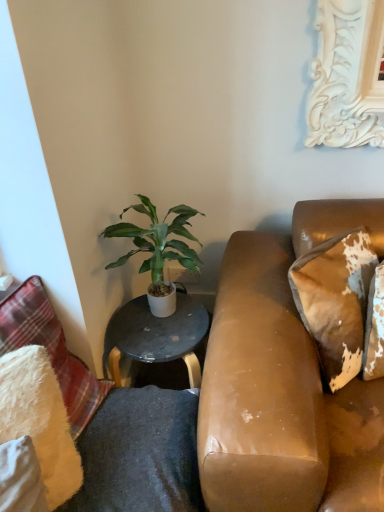
The width and height of the screenshot is (384, 512). What do you see at coordinates (51, 349) in the screenshot? I see `fluffy white pillow at left, the 1th pillow in the left-to-right sequence` at bounding box center [51, 349].

What do you see at coordinates (39, 419) in the screenshot? This screenshot has height=512, width=384. I see `white fluffy pillow at lower left, placed as the 2th pillow when sorted from left to right` at bounding box center [39, 419].

Describe the element at coordinates (154, 338) in the screenshot. I see `white glossy table at center` at that location.

What is the approximate width of leather-like brown pillow at right, the 1th pillow viewed from the right?

10.71 inches.

You are a GUI agent. You are given a task and a screenshot of the screen. Output one action in this format:
    pyautogui.click(x=<x>, y=<y>)
    Task: Click on the green leafy plant at center
    
    Given the screenshot: What is the action you would take?
    pyautogui.click(x=157, y=242)

Identify the location of fluffy white pillow at left, which is the third pillow from right to left. Image resolution: width=384 pixels, height=512 pixels. (51, 349).

Does point (315, 272) lie in front of point (140, 305)?

Yes, it is in front of point (140, 305).

Are leather-like brown pillow at right, placed as the third pillow when sorted from left to right, and white glossy table at center located far from each other?

No, leather-like brown pillow at right, placed as the third pillow when sorted from left to right, is in close proximity to white glossy table at center.

From the image's perspective, is leather-like brown pillow at right, the 1th pillow viewed from the right, on white glossy table at center?

Yes, from the image's perspective, leather-like brown pillow at right, the 1th pillow viewed from the right, is on top of white glossy table at center.

Who is shorter, fluffy white pillow at left, the 1th pillow in the left-to-right sequence, or green leafy plant at center?

fluffy white pillow at left, the 1th pillow in the left-to-right sequence, is shorter.

Which of these two, fluffy white pillow at left, which is the third pillow from right to left, or green leafy plant at center, is smaller?

With smaller size is green leafy plant at center.

Looking at this image, from the image's perspective, is fluffy white pillow at left, which is the third pillow from right to left, below green leafy plant at center?

Yes, from the image's perspective, fluffy white pillow at left, which is the third pillow from right to left, is beneath green leafy plant at center.

Based on the photo, is fluffy white pillow at left, the 1th pillow in the left-to-right sequence, oriented away from green leafy plant at center?

No, fluffy white pillow at left, the 1th pillow in the left-to-right sequence, is not facing the opposite direction of green leafy plant at center.

In terms of width, does white fluffy pillow at lower left, placed as the 2th pillow when sorted from left to right, look wider or thinner when compared to green leafy plant at center?

Considering their sizes, white fluffy pillow at lower left, placed as the 2th pillow when sorted from left to right, looks slimmer than green leafy plant at center.

Based on the photo, from a real-world perspective, is white fluffy pillow at lower left, placed as the 2th pillow when sorted from left to right, above or below green leafy plant at center?

white fluffy pillow at lower left, placed as the 2th pillow when sorted from left to right, is below green leafy plant at center.

Looking at this image, is white fluffy pillow at lower left, placed as the 2th pillow when sorted from right to left, not within green leafy plant at center?

That's correct, white fluffy pillow at lower left, placed as the 2th pillow when sorted from right to left, is outside of green leafy plant at center.

From their relative heights in the image, would you say white fluffy pillow at lower left, placed as the 2th pillow when sorted from right to left, is taller or shorter than green leafy plant at center?

Considering their sizes, white fluffy pillow at lower left, placed as the 2th pillow when sorted from right to left, has less height than green leafy plant at center.

Is white fluffy pillow at lower left, placed as the 2th pillow when sorted from right to left, placed right next to white glossy table at center?

No, white fluffy pillow at lower left, placed as the 2th pillow when sorted from right to left, is not touching white glossy table at center.

What are the coordinates of `the 3rd pillow in front of the white glossy table at center, counting from the anchor's position` in the screenshot? It's located at (39, 419).

Relative to white glossy table at center, is white fluffy pillow at lower left, placed as the 2th pillow when sorted from left to right, in front or behind?

In the image, white fluffy pillow at lower left, placed as the 2th pillow when sorted from left to right, appears in front of white glossy table at center.

Considering the relative sizes of white fluffy pillow at lower left, placed as the 2th pillow when sorted from right to left, and white glossy table at center in the image provided, is white fluffy pillow at lower left, placed as the 2th pillow when sorted from right to left, thinner than white glossy table at center?

Yes, white fluffy pillow at lower left, placed as the 2th pillow when sorted from right to left, is thinner than white glossy table at center.

Do you think fluffy white pillow at left, the 1th pillow in the left-to-right sequence, is within leather-like brown pillow at right, placed as the third pillow when sorted from left to right, or outside of it?

fluffy white pillow at left, the 1th pillow in the left-to-right sequence, is outside leather-like brown pillow at right, placed as the third pillow when sorted from left to right.

Based on the photo, does fluffy white pillow at left, the 1th pillow in the left-to-right sequence, have a greater width compared to leather-like brown pillow at right, placed as the third pillow when sorted from left to right?

Yes, fluffy white pillow at left, the 1th pillow in the left-to-right sequence, is wider than leather-like brown pillow at right, placed as the third pillow when sorted from left to right.

Which is nearer, (x=26, y=283) or (x=329, y=381)?

Point (x=26, y=283)

Is leather-like brown pillow at right, the 1th pillow viewed from the right, at the back of fluffy white pillow at left, the 1th pillow in the left-to-right sequence?

No, leather-like brown pillow at right, the 1th pillow viewed from the right, is not at the back of fluffy white pillow at left, the 1th pillow in the left-to-right sequence.

Is leather-like brown pillow at right, placed as the third pillow when sorted from left to right, to the left of white fluffy pillow at lower left, placed as the 2th pillow when sorted from left to right, from the viewer's perspective?

In fact, leather-like brown pillow at right, placed as the third pillow when sorted from left to right, is to the right of white fluffy pillow at lower left, placed as the 2th pillow when sorted from left to right.

From a real-world perspective, which is physically below, leather-like brown pillow at right, the 1th pillow viewed from the right, or white fluffy pillow at lower left, placed as the 2th pillow when sorted from left to right?

From a 3D spatial view, white fluffy pillow at lower left, placed as the 2th pillow when sorted from left to right, is below.

How different are the orientations of fluffy white pillow at left, which is the third pillow from right to left, and white glossy table at center in degrees?

There is a 66-degree angle between the facing directions of fluffy white pillow at left, which is the third pillow from right to left, and white glossy table at center.

Consider the image. Could white glossy table at center be considered to be inside fluffy white pillow at left, which is the third pillow from right to left?

No, white glossy table at center is not a part of fluffy white pillow at left, which is the third pillow from right to left.

Which is closer, (5, 324) or (105, 372)?

Point (5, 324) is closer to the camera than point (105, 372).

Is fluffy white pillow at left, which is the third pillow from right to left, closer to camera compared to white glossy table at center?

Yes, fluffy white pillow at left, which is the third pillow from right to left, is in front of white glossy table at center.

Where is `table below the leather-like brown pillow at right, the 1th pillow viewed from the right (from a real-world perspective)`? table below the leather-like brown pillow at right, the 1th pillow viewed from the right (from a real-world perspective) is located at coordinates (154, 338).

Locate an element on the screen. houseplant above the fluffy white pillow at left, the 1th pillow in the left-to-right sequence (from the image's perspective) is located at coordinates (157, 242).

From the image, which object appears to be nearer to white fluffy pillow at lower left, placed as the 2th pillow when sorted from right to left, leather-like brown pillow at right, placed as the third pillow when sorted from left to right, or white glossy table at center?

white glossy table at center lies closer to white fluffy pillow at lower left, placed as the 2th pillow when sorted from right to left, than the other object.

Based on their spatial positions, is green leafy plant at center or white fluffy pillow at lower left, placed as the 2th pillow when sorted from right to left, further from leather-like brown pillow at right, placed as the third pillow when sorted from left to right?

Among the two, white fluffy pillow at lower left, placed as the 2th pillow when sorted from right to left, is located further to leather-like brown pillow at right, placed as the third pillow when sorted from left to right.

Considering their positions, is leather-like brown pillow at right, the 1th pillow viewed from the right, positioned further to green leafy plant at center than fluffy white pillow at left, which is the third pillow from right to left?

leather-like brown pillow at right, the 1th pillow viewed from the right.

Which object lies nearer to the anchor point white glossy table at center, leather-like brown pillow at right, placed as the third pillow when sorted from left to right, or white fluffy pillow at lower left, placed as the 2th pillow when sorted from right to left?

Based on the image, white fluffy pillow at lower left, placed as the 2th pillow when sorted from right to left, appears to be nearer to white glossy table at center.

Looking at the image, which one is located closer to white fluffy pillow at lower left, placed as the 2th pillow when sorted from right to left, white glossy table at center or fluffy white pillow at left, which is the third pillow from right to left?

fluffy white pillow at left, which is the third pillow from right to left, is positioned closer to the anchor white fluffy pillow at lower left, placed as the 2th pillow when sorted from right to left.

From the image, which object appears to be nearer to fluffy white pillow at left, the 1th pillow in the left-to-right sequence, white fluffy pillow at lower left, placed as the 2th pillow when sorted from right to left, or green leafy plant at center?

Based on the image, white fluffy pillow at lower left, placed as the 2th pillow when sorted from right to left, appears to be nearer to fluffy white pillow at left, the 1th pillow in the left-to-right sequence.

Which object lies nearer to the anchor point leather-like brown pillow at right, placed as the third pillow when sorted from left to right, white glossy table at center or fluffy white pillow at left, the 1th pillow in the left-to-right sequence?

Based on the image, white glossy table at center appears to be nearer to leather-like brown pillow at right, placed as the third pillow when sorted from left to right.

Looking at the image, which one is located further to green leafy plant at center, white fluffy pillow at lower left, placed as the 2th pillow when sorted from right to left, or fluffy white pillow at left, which is the third pillow from right to left?

white fluffy pillow at lower left, placed as the 2th pillow when sorted from right to left.

This screenshot has height=512, width=384. Identify the location of table situated between fluffy white pillow at left, which is the third pillow from right to left, and leather-like brown pillow at right, the 1th pillow viewed from the right, from left to right. (x=154, y=338).

The image size is (384, 512). In order to click on houseplant between white fluffy pillow at lower left, placed as the 2th pillow when sorted from left to right, and leather-like brown pillow at right, the 1th pillow viewed from the right in this screenshot , I will do `click(157, 242)`.

In order to click on pillow between fluffy white pillow at left, the 1th pillow in the left-to-right sequence, and leather-like brown pillow at right, the 1th pillow viewed from the right in this screenshot , I will do pos(39,419).

In order to click on table situated between white fluffy pillow at lower left, placed as the 2th pillow when sorted from right to left, and leather-like brown pillow at right, the 1th pillow viewed from the right, from left to right in this screenshot , I will do `click(154, 338)`.